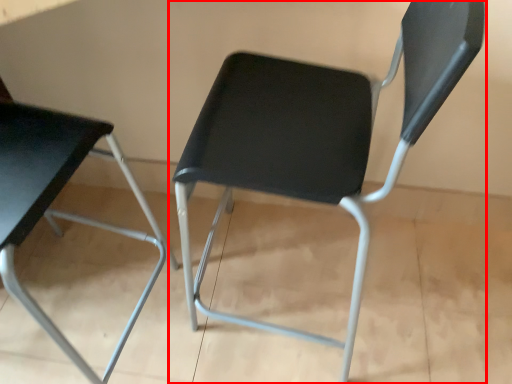
Question: From the image's perspective, where is chair (annotated by the red box) located in relation to chair in the image?

Choices:
 (A) above
 (B) below

Answer: (A)